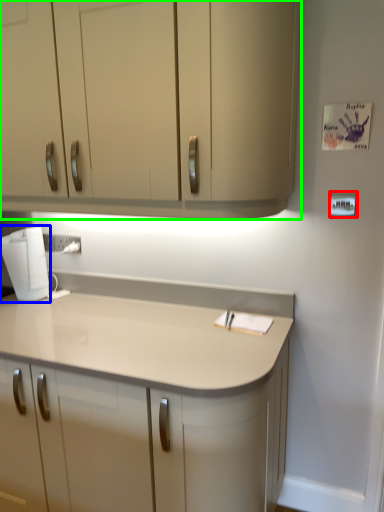
Question: Which object is the farthest from light switch (highlighted by a red box)? Choose among these: home appliance (highlighted by a blue box) or cabinetry (highlighted by a green box).

Choices:
 (A) home appliance
 (B) cabinetry

Answer: (A)